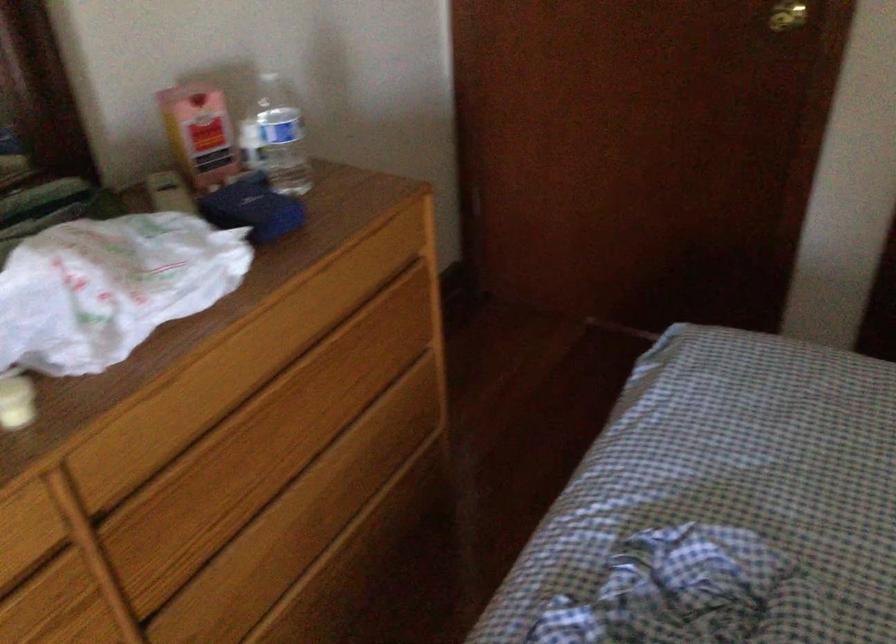
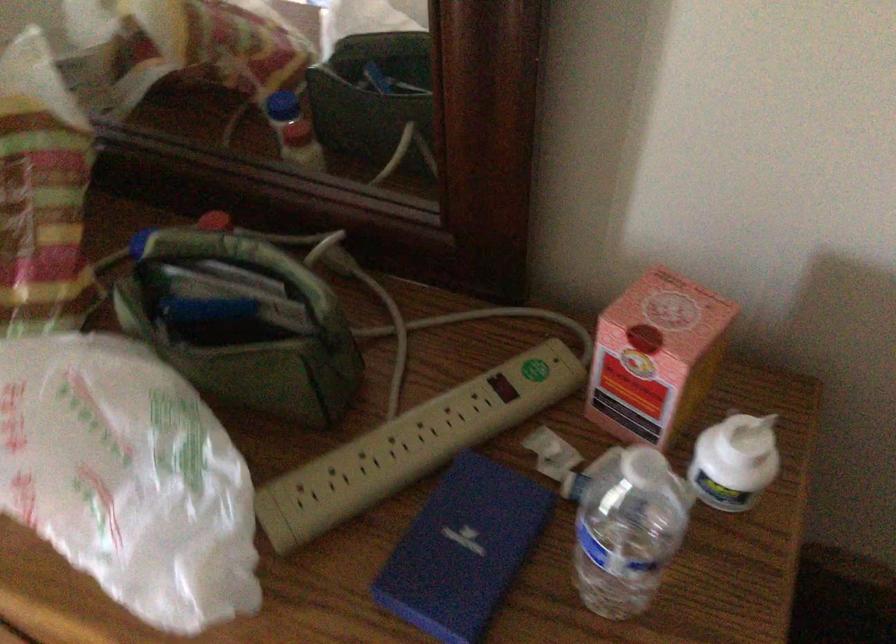
In the second image, find the point that corresponds to [254,204] in the first image.

(462, 550)